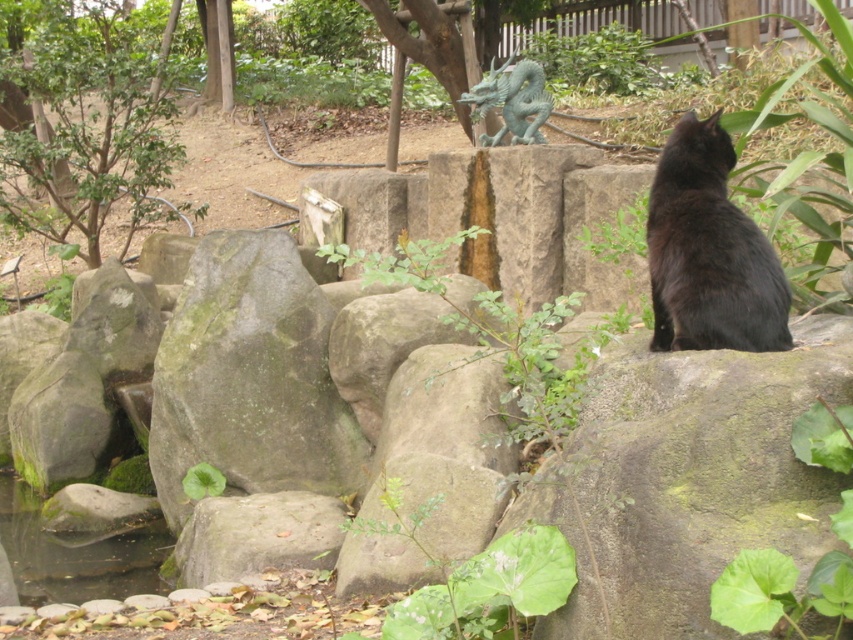
Can you confirm if green leafy tree at upper left is thinner than green patina dragon at center?

In fact, green leafy tree at upper left might be wider than green patina dragon at center.

Who is more distant from viewer, (140, 172) or (540, 104)?

Positioned behind is point (140, 172).

I want to click on green leafy tree at upper left, so click(82, 120).

Is green leafy tree at upper left bigger than black fur cat at right?

Indeed, green leafy tree at upper left has a larger size compared to black fur cat at right.

Can you confirm if green leafy tree at upper left is positioned to the left of black fur cat at right?

Correct, you'll find green leafy tree at upper left to the left of black fur cat at right.

Is point (86, 17) closer to viewer compared to point (660, 230)?

No.

The height and width of the screenshot is (640, 853). Identify the location of green leafy tree at upper left. [x=82, y=120].

Is black fur cat at right closer to camera compared to green patina dragon at center?

Yes, black fur cat at right is in front of green patina dragon at center.

Does point (682, 333) come behind point (544, 120)?

No, it is in front of (544, 120).

This screenshot has width=853, height=640. I want to click on black fur cat at right, so click(x=709, y=252).